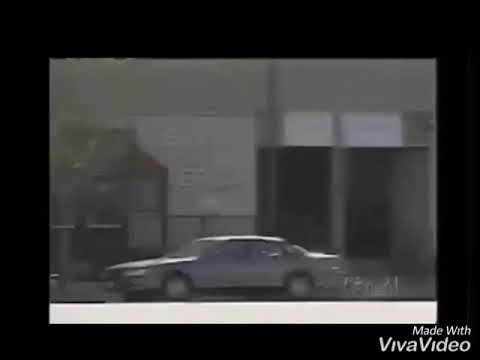
This screenshot has width=480, height=360. What are the coordinates of `wall` in the screenshot? It's located at (173, 89), (334, 104).